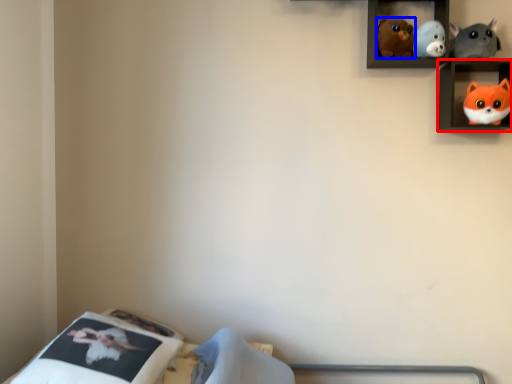
Question: Which object appears closest to the camera in this image, shelf (highlighted by a red box) or toy (highlighted by a blue box)?

Choices:
 (A) shelf
 (B) toy

Answer: (A)